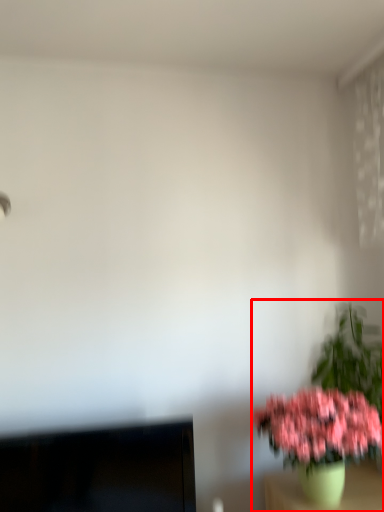
Question: From the image's perspective, where is houseplant (annotated by the red box) located relative to computer monitor?

Choices:
 (A) above
 (B) below

Answer: (A)